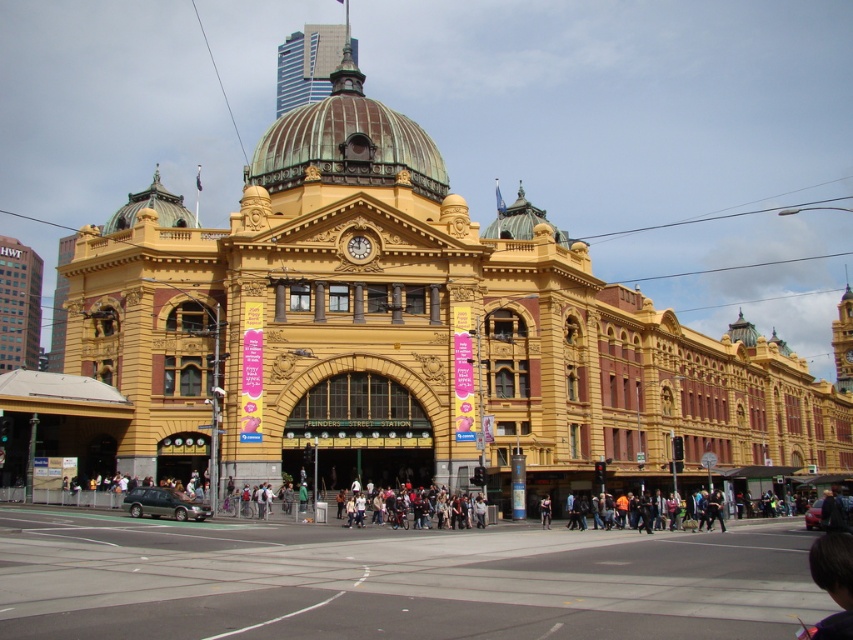
Question: Does green copper dome at center have a greater width compared to matte black backpack at center?

Choices:
 (A) no
 (B) yes

Answer: (B)

Question: Which point is farther to the camera?

Choices:
 (A) green copper dome at center
 (B) matte black backpack at center

Answer: (A)

Question: Which point appears farthest from the camera in this image?

Choices:
 (A) (352, 86)
 (B) (357, 518)

Answer: (A)

Question: Considering the relative positions of green copper dome at center and matte black backpack at center in the image provided, where is green copper dome at center located with respect to matte black backpack at center?

Choices:
 (A) right
 (B) left

Answer: (B)

Question: Does green copper dome at center have a smaller size compared to matte black backpack at center?

Choices:
 (A) no
 (B) yes

Answer: (A)